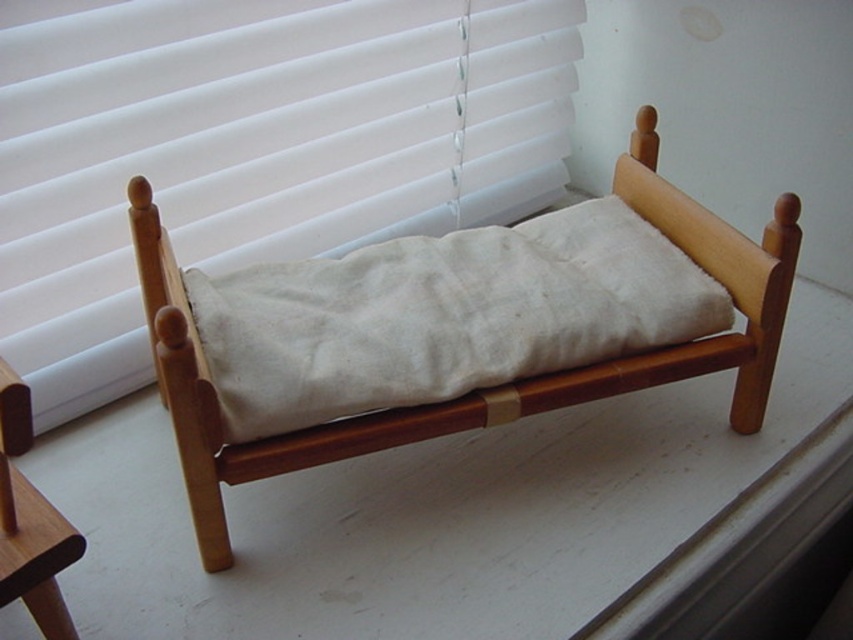
Question: Considering the real-world distances, which object is farthest from the white fabric blinds at upper center?

Choices:
 (A) natural wood bed at center
 (B) white cotton pillow at center

Answer: (B)

Question: Is natural wood bed at center to the right of white cotton pillow at center from the viewer's perspective?

Choices:
 (A) no
 (B) yes

Answer: (A)

Question: Among these points, which one is farthest from the camera?

Choices:
 (A) (364, 294)
 (B) (538, 259)
 (C) (7, 548)
 (D) (152, 307)

Answer: (B)

Question: Which of the following is the farthest from the observer?

Choices:
 (A) brown wood chair at lower left
 (B) natural wood bed at center
 (C) white fabric blinds at upper center
 (D) white cotton pillow at center

Answer: (D)

Question: Can you confirm if natural wood bed at center is thinner than white cotton pillow at center?

Choices:
 (A) yes
 (B) no

Answer: (B)

Question: Is white fabric blinds at upper center smaller than brown wood chair at lower left?

Choices:
 (A) yes
 (B) no

Answer: (B)